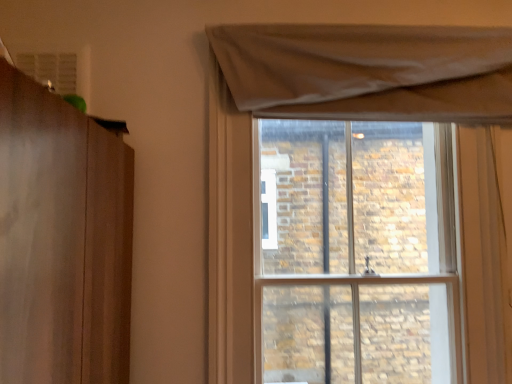
Question: In the image, is matte beige curtain at upper right positioned in front of or behind brown stone wall at upper center?

Choices:
 (A) behind
 (B) front

Answer: (B)

Question: In terms of width, does matte beige curtain at upper right look wider or thinner when compared to brown stone wall at upper center?

Choices:
 (A) thin
 (B) wide

Answer: (A)

Question: From the image's perspective, relative to brown stone wall at upper center, is matte beige curtain at upper right above or below?

Choices:
 (A) above
 (B) below

Answer: (A)

Question: Would you say brown stone wall at upper center is inside or outside matte beige curtain at upper right?

Choices:
 (A) inside
 (B) outside

Answer: (B)

Question: Considering the positions of brown stone wall at upper center and matte beige curtain at upper right in the image, is brown stone wall at upper center wider or thinner than matte beige curtain at upper right?

Choices:
 (A) thin
 (B) wide

Answer: (B)

Question: In terms of height, does brown stone wall at upper center look taller or shorter compared to matte beige curtain at upper right?

Choices:
 (A) short
 (B) tall

Answer: (B)

Question: Is brown stone wall at upper center to the left or to the right of matte beige curtain at upper right in the image?

Choices:
 (A) left
 (B) right

Answer: (B)